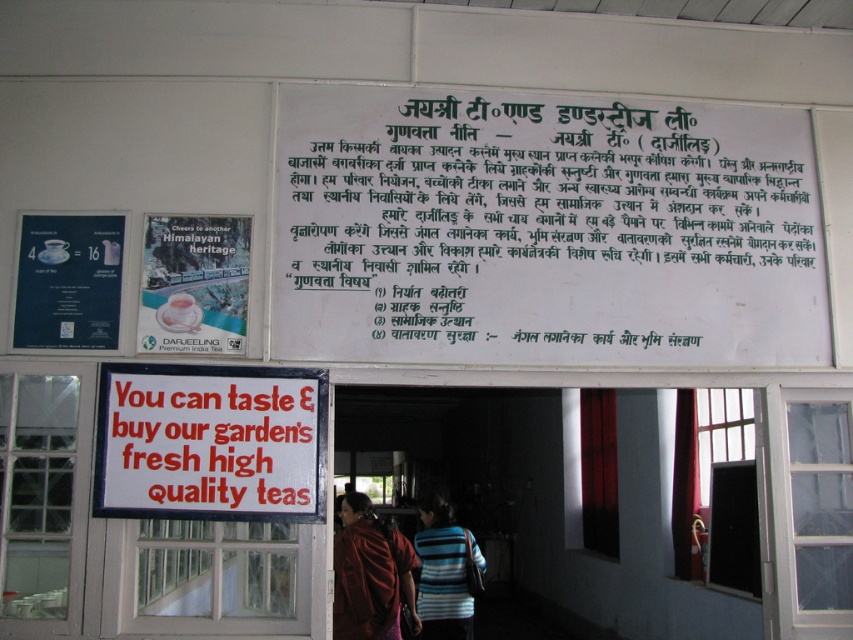
Looking at this image, which is more to the right, matte black cup at upper left or striped fabric sweater at center?

striped fabric sweater at center is more to the right.

Does matte black cup at upper left have a greater width compared to striped fabric sweater at center?

No, matte black cup at upper left is not wider than striped fabric sweater at center.

The image size is (853, 640). I want to click on matte black cup at upper left, so click(x=68, y=282).

Describe the element at coordinates (544, 230) in the screenshot. The width and height of the screenshot is (853, 640). I see `white paper at center` at that location.

Can you confirm if white paper at center is positioned below striped fabric sweater at center?

Incorrect, white paper at center is not positioned below striped fabric sweater at center.

You are a GUI agent. You are given a task and a screenshot of the screen. Output one action in this format:
    pyautogui.click(x=<x>, y=<y>)
    Task: Click on the white paper at center
    The width and height of the screenshot is (853, 640).
    Given the screenshot: What is the action you would take?
    pyautogui.click(x=544, y=230)

Describe the element at coordinates (194, 284) in the screenshot. The height and width of the screenshot is (640, 853). I see `white paper poster at upper center` at that location.

I want to click on white paper poster at upper center, so click(x=194, y=284).